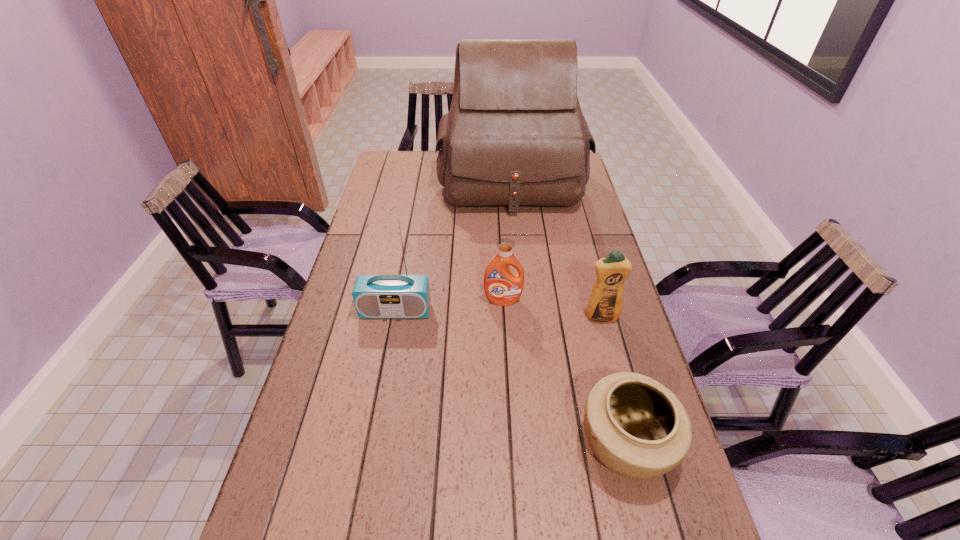
I want to click on satchel, so click(515, 135).

Where is `the farthest object`? Image resolution: width=960 pixels, height=540 pixels. the farthest object is located at coordinates (515, 135).

Find the location of a particular element. The height and width of the screenshot is (540, 960). radio receiver is located at coordinates (375, 296).

You are a GUI agent. You are given a task and a screenshot of the screen. Output one action in this format:
    pyautogui.click(x=<x>, y=<y>)
    Task: Click on the nearer detergent
    The image size is (960, 540).
    Given the screenshot: What is the action you would take?
    pyautogui.click(x=605, y=304)

Locate an element on the screen. the left detergent is located at coordinates (502, 286).

Identify the location of the shortest object. (636, 427).

At what (x,y) coordinates should I click in order to perform the action: click on the nearest object. Please return your answer as a coordinate pair (x, y). This screenshot has width=960, height=540. Looking at the image, I should click on (636, 427).

Locate an element on the screen. This screenshot has width=960, height=540. vacant position located 0.080m on the front flap of the satchel is located at coordinates (516, 232).

Image resolution: width=960 pixels, height=540 pixels. Find the location of `blank area located on the front panel of the second tallest object`. blank area located on the front panel of the second tallest object is located at coordinates (372, 437).

What are the coordinates of `vacant space located on the label of the right detergent` in the screenshot? It's located at (631, 429).